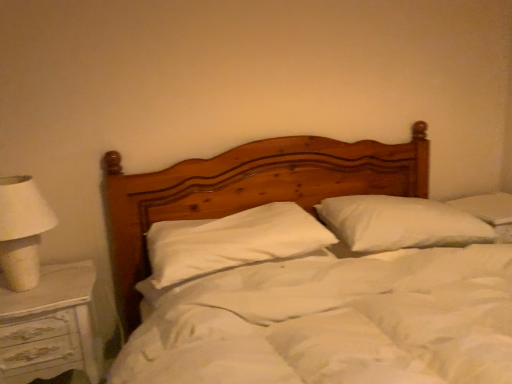
Question: Is white soft pillow at center, which is counted as the 2th pillow, starting from the right, to the left of white painted wood nightstand at left from the viewer's perspective?

Choices:
 (A) yes
 (B) no

Answer: (B)

Question: Is the surface of white soft pillow at center, the 1th pillow when ordered from left to right, in direct contact with white painted wood nightstand at left?

Choices:
 (A) no
 (B) yes

Answer: (A)

Question: Is white soft pillow at center, the 1th pillow when ordered from left to right, bigger than white painted wood nightstand at left?

Choices:
 (A) yes
 (B) no

Answer: (B)

Question: Does white soft pillow at center, which is counted as the 2th pillow, starting from the right, have a smaller size compared to white painted wood nightstand at left?

Choices:
 (A) yes
 (B) no

Answer: (A)

Question: Does white soft pillow at center, which is counted as the 2th pillow, starting from the right, lie in front of white painted wood nightstand at left?

Choices:
 (A) yes
 (B) no

Answer: (B)

Question: From a real-world perspective, relative to white painted wood nightstand at left, is white fabric lampshade at left vertically above or below?

Choices:
 (A) below
 (B) above

Answer: (B)

Question: From the image's perspective, is white fabric lampshade at left above or below white painted wood nightstand at left?

Choices:
 (A) below
 (B) above

Answer: (B)

Question: Considering the positions of white fabric lampshade at left and white painted wood nightstand at left in the image, is white fabric lampshade at left wider or thinner than white painted wood nightstand at left?

Choices:
 (A) wide
 (B) thin

Answer: (B)

Question: From their relative heights in the image, would you say white fabric lampshade at left is taller or shorter than white painted wood nightstand at left?

Choices:
 (A) tall
 (B) short

Answer: (B)

Question: From a real-world perspective, is white soft pillow at center, which is counted as the second pillow, starting from the left, physically located above or below white soft pillow at center, the 1th pillow when ordered from left to right?

Choices:
 (A) above
 (B) below

Answer: (B)

Question: Is white soft pillow at center, the 1th pillow in the right-to-left sequence, to the left or to the right of white soft pillow at center, the 1th pillow when ordered from left to right, in the image?

Choices:
 (A) left
 (B) right

Answer: (B)

Question: Considering the positions of white soft pillow at center, the 1th pillow in the right-to-left sequence, and white soft pillow at center, which is counted as the 2th pillow, starting from the right, in the image, is white soft pillow at center, the 1th pillow in the right-to-left sequence, taller or shorter than white soft pillow at center, which is counted as the 2th pillow, starting from the right,?

Choices:
 (A) tall
 (B) short

Answer: (A)

Question: Is point (332, 216) positioned closer to the camera than point (273, 206)?

Choices:
 (A) closer
 (B) farther

Answer: (B)

Question: From a real-world perspective, is white fabric lampshade at left positioned above or below wooden bed at center?

Choices:
 (A) above
 (B) below

Answer: (A)

Question: In terms of height, does white fabric lampshade at left look taller or shorter compared to wooden bed at center?

Choices:
 (A) tall
 (B) short

Answer: (B)